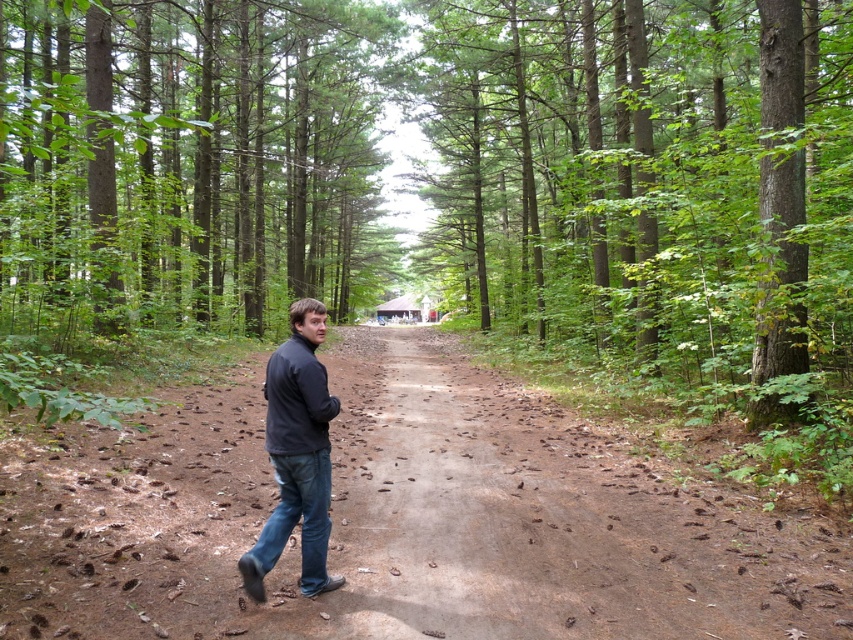
Who is taller, brown dirt road at center or dark blue fleece at center?

Standing taller between the two is dark blue fleece at center.

Is point (534, 465) positioned before point (302, 387)?

No, (534, 465) is further to viewer.

Where is `brown dirt road at center`? brown dirt road at center is located at coordinates (401, 520).

What are the coordinates of `brown dirt road at center` in the screenshot? It's located at pos(401,520).

This screenshot has width=853, height=640. What do you see at coordinates (653, 182) in the screenshot? I see `green rough bark tree at center` at bounding box center [653, 182].

Does green rough bark tree at center have a larger size compared to green matte tree at center?

Actually, green rough bark tree at center might be smaller than green matte tree at center.

Does point (485, 115) lie behind point (187, 280)?

Yes, point (485, 115) is farther from viewer.

Where is `green rough bark tree at center`? This screenshot has height=640, width=853. green rough bark tree at center is located at coordinates (653, 182).

Which is in front, point (61, 180) or point (310, 493)?

Positioned in front is point (310, 493).

Is point (282, 196) farther from viewer compared to point (321, 522)?

Yes, point (282, 196) is behind point (321, 522).

At what (x,y) coordinates should I click in order to perform the action: click on green matte tree at center. Please return your answer as a coordinate pair (x, y). Looking at the image, I should click on (187, 161).